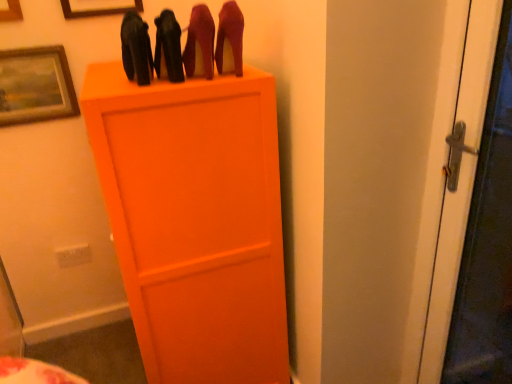
Question: From a real-world perspective, is wooden picture frame at upper left, placed as the first picture frame when sorted from top to bottom, on top of wooden framed picture at upper left, positioned as the first picture frame in bottom-to-top order?

Choices:
 (A) yes
 (B) no

Answer: (A)

Question: Is wooden picture frame at upper left, the third picture frame ordered from the bottom, facing away from wooden framed picture at upper left, positioned as the first picture frame in bottom-to-top order?

Choices:
 (A) no
 (B) yes

Answer: (A)

Question: Is wooden picture frame at upper left, placed as the first picture frame when sorted from top to bottom, to the left of wooden framed picture at upper left, positioned as the first picture frame in bottom-to-top order, from the viewer's perspective?

Choices:
 (A) yes
 (B) no

Answer: (B)

Question: Is wooden picture frame at upper left, the third picture frame ordered from the bottom, directly adjacent to wooden framed picture at upper left, positioned as the first picture frame in bottom-to-top order?

Choices:
 (A) yes
 (B) no

Answer: (B)

Question: Is wooden picture frame at upper left, the third picture frame ordered from the bottom, thinner than wooden framed picture at upper left, the 3th picture frame in the top-to-bottom sequence?

Choices:
 (A) yes
 (B) no

Answer: (A)

Question: From a real-world perspective, is wooden picture frame at upper left, the third picture frame ordered from the bottom, physically below wooden framed picture at upper left, the 3th picture frame in the top-to-bottom sequence?

Choices:
 (A) no
 (B) yes

Answer: (A)

Question: Considering the relative positions of wooden picture frame at upper left, which appears as the second picture frame when viewed from the top, and wooden picture frame at upper left, placed as the first picture frame when sorted from top to bottom, in the image provided, is wooden picture frame at upper left, which appears as the second picture frame when viewed from the top, to the left of wooden picture frame at upper left, placed as the first picture frame when sorted from top to bottom, from the viewer's perspective?

Choices:
 (A) yes
 (B) no

Answer: (A)

Question: Can you confirm if wooden picture frame at upper left, which appears as the second picture frame when viewed from the top, is shorter than wooden picture frame at upper left, the third picture frame ordered from the bottom?

Choices:
 (A) yes
 (B) no

Answer: (B)

Question: From the image's perspective, is wooden picture frame at upper left, the 2th picture frame in the bottom-to-top sequence, on wooden picture frame at upper left, placed as the first picture frame when sorted from top to bottom?

Choices:
 (A) no
 (B) yes

Answer: (A)

Question: Does wooden picture frame at upper left, the 2th picture frame in the bottom-to-top sequence, have a greater width compared to wooden picture frame at upper left, the third picture frame ordered from the bottom?

Choices:
 (A) yes
 (B) no

Answer: (B)

Question: Is wooden picture frame at upper left, which appears as the second picture frame when viewed from the top, placed right next to wooden picture frame at upper left, the third picture frame ordered from the bottom?

Choices:
 (A) no
 (B) yes

Answer: (A)

Question: Is wooden picture frame at upper left, which appears as the second picture frame when viewed from the top, positioned with its back to wooden picture frame at upper left, placed as the first picture frame when sorted from top to bottom?

Choices:
 (A) no
 (B) yes

Answer: (A)

Question: Is wooden picture frame at upper left, placed as the first picture frame when sorted from top to bottom, positioned far away from matte black high-heels at upper center, which appears as the first stuff when viewed from the left?

Choices:
 (A) yes
 (B) no

Answer: (B)